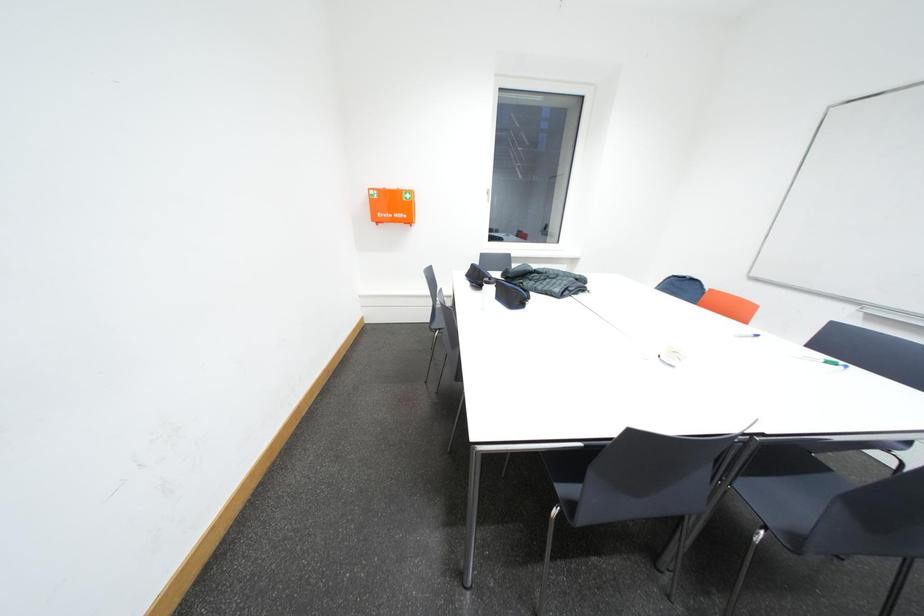
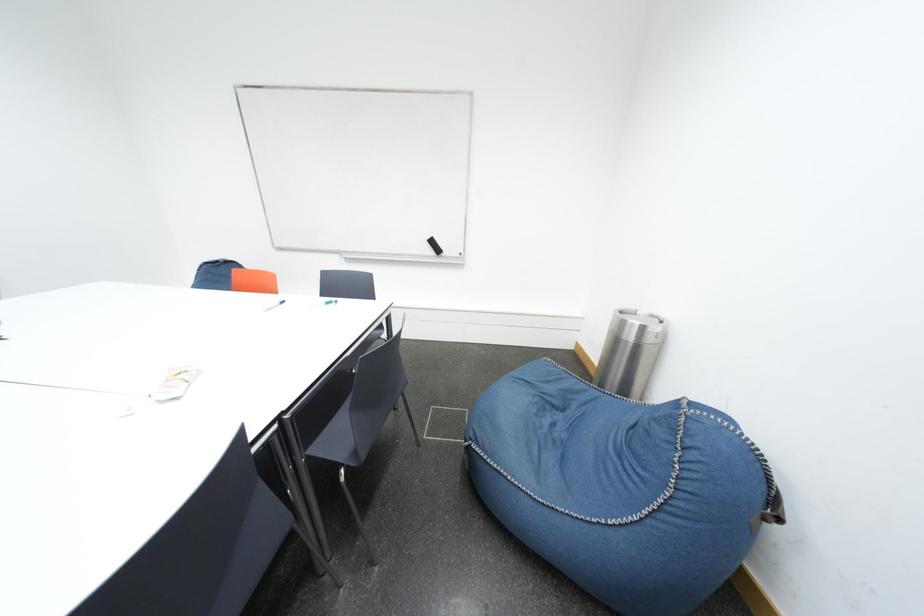
How did the camera likely rotate?

The camera's rotation is toward right-down.